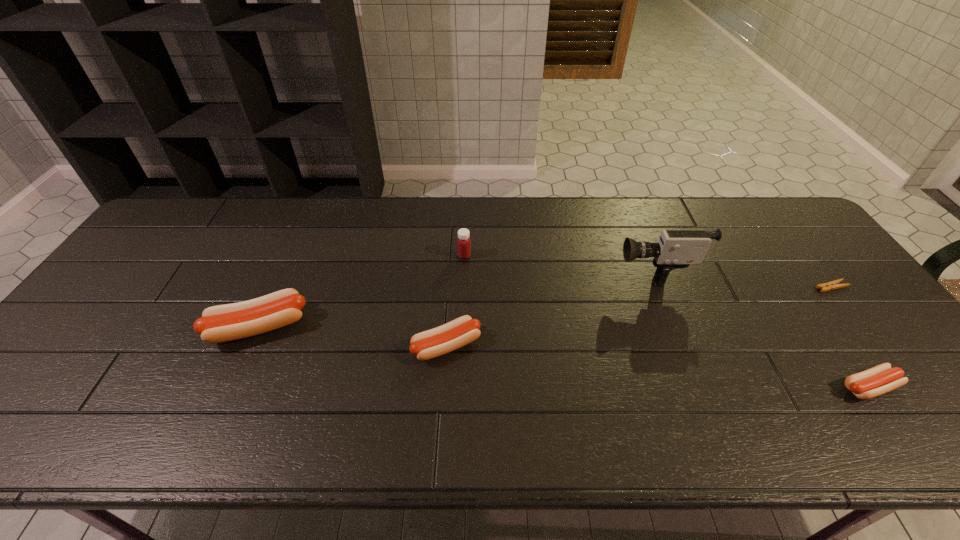
To make them evenly spaced by inserting another sausage among them, please locate a vacant spot for this new sausage. Please provide its 2D coordinates. Your answer should be formatted as a tuple, i.e. [(x, y)], where the tuple contains the x and y coordinates of a point satisfying the conditions above.

[(649, 366)]